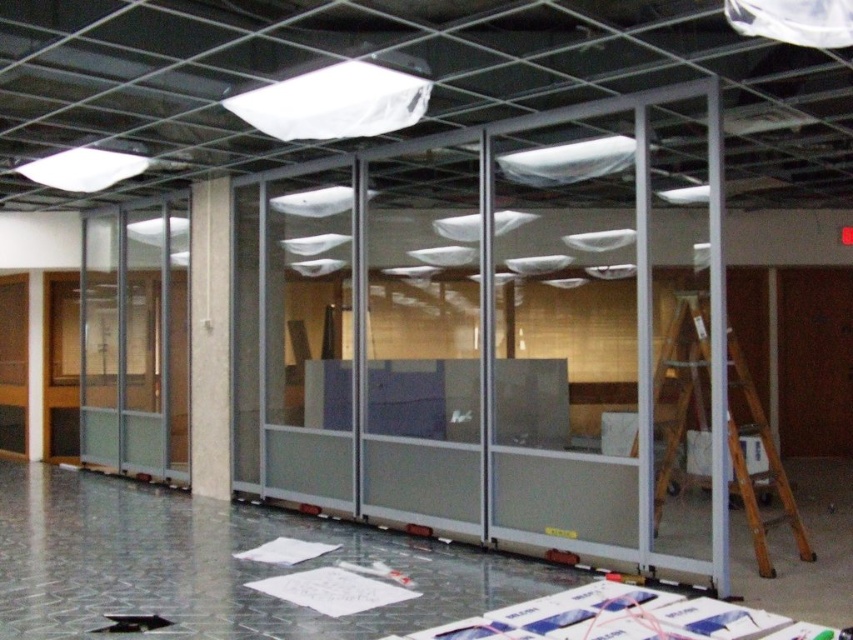
Which is below, white marble pillar at center or white matte paper at lower center?

Positioned lower is white matte paper at lower center.

Consider the image. Between white marble pillar at center and white matte paper at lower center, which one has less height?

Standing shorter between the two is white matte paper at lower center.

Locate an element on the screen. The width and height of the screenshot is (853, 640). white marble pillar at center is located at coordinates (210, 337).

Does wooden ladder at right have a lesser height compared to white marble pillar at center?

Yes, wooden ladder at right is shorter than white marble pillar at center.

Between wooden ladder at right and white marble pillar at center, which one appears on the left side from the viewer's perspective?

white marble pillar at center

Which is behind, point (666, 429) or point (190, 205)?

Point (190, 205)

At what (x,y) coordinates should I click in order to perform the action: click on wooden ladder at right. Please return your answer as a coordinate pair (x, y). Looking at the image, I should click on (682, 396).

Who is taller, wooden ladder at right or white matte paper at lower center?

Standing taller between the two is wooden ladder at right.

Which is above, wooden ladder at right or white matte paper at lower center?

wooden ladder at right is above.

Between point (764, 566) and point (251, 550), which one is positioned behind?

Point (251, 550)

Find the location of a particular element. This screenshot has width=853, height=640. wooden ladder at right is located at coordinates (682, 396).